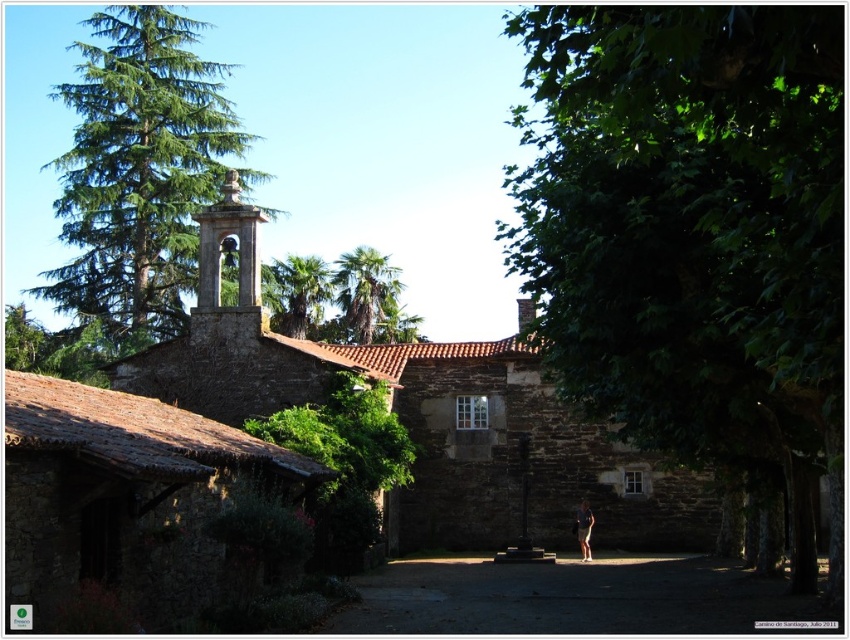
You are planning to plant a new tree in the garden next to the traditional stone building. The garden has limited space. Which tree, the green leafy tree at center right or the green coniferous tree at upper left, would be more suitable if you want a tree that takes up less horizontal space?

The green leafy tree at center right has a lesser width compared to the green coniferous tree at upper left, so it would be more suitable for limited space as it takes up less horizontal space.

You are standing in front of the traditional stone building and want to take a photo that includes both the green leafy tree at center right and the green coniferous tree at upper left. Which tree should you pan your camera towards first to ensure both are in the frame?

You should pan your camera towards the green coniferous tree at upper left first because the green leafy tree at center right is positioned on its right side, so capturing the coniferous tree first ensures both are included in the frame.